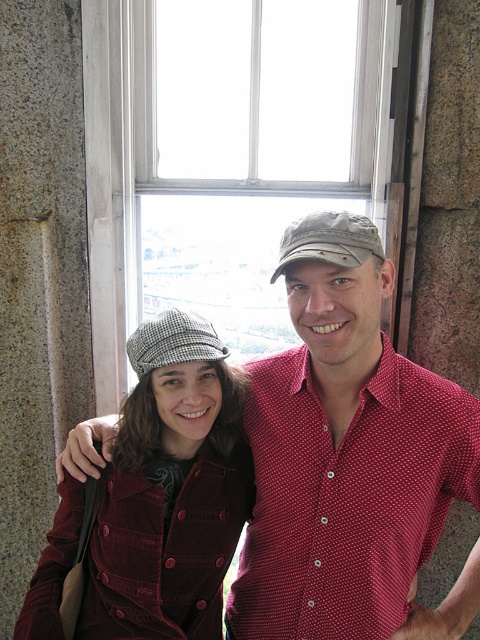
Please describe the exact location of the matte red shirt at center in the image using coordinates. The answer should be in the format of coordinates in parentheses.

The matte red shirt at center is located at point coordinates of (349, 458).

In the scene shown: You are a tailor who needs to determine which garment requires more fabric to make between the red dotted shirt at center and the velvet maroon coat at center. Based on the image, which one would need more fabric?

The velvet maroon coat at center requires more fabric because its width is greater than the red dotted shirt at center.

Based on the scene description, which object, the matte red shirt at center or the velvet maroon coat at center, is bigger in size?

The matte red shirt at center is larger in size compared to the velvet maroon coat at center according to the description.